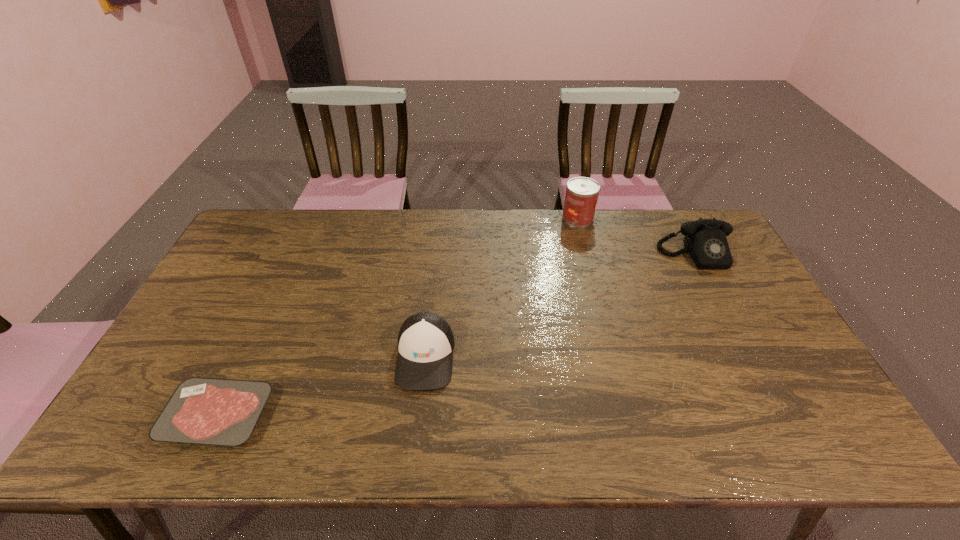
Where is `vacant area located 0.280m on the right of the shortest object`? Image resolution: width=960 pixels, height=540 pixels. vacant area located 0.280m on the right of the shortest object is located at coordinates (386, 416).

Locate an element on the screen. The height and width of the screenshot is (540, 960). can present at the far edge is located at coordinates (582, 193).

Identify the location of telephone that is at the far edge. (705, 240).

Locate an element on the screen. The image size is (960, 540). object present at the near edge is located at coordinates (210, 411).

Identify the location of object that is at the left edge. (210, 411).

Identify the location of object located at the right edge. (705, 240).

Locate an element on the screen. object positioned at the near left corner is located at coordinates (210, 411).

Locate an element on the screen. The width and height of the screenshot is (960, 540). object located in the far right corner section of the desktop is located at coordinates (705, 240).

In the image, there is a desktop. Identify the location of vacant space at the far edge. The width and height of the screenshot is (960, 540). (332, 212).

The image size is (960, 540). In the image, there is a desktop. Find the location of `vacant space at the left edge`. vacant space at the left edge is located at coordinates (224, 292).